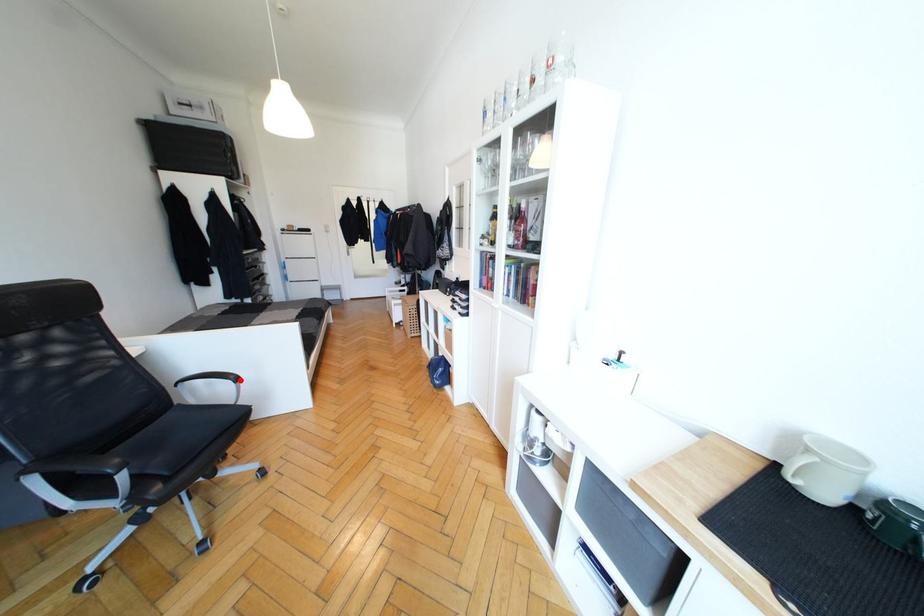
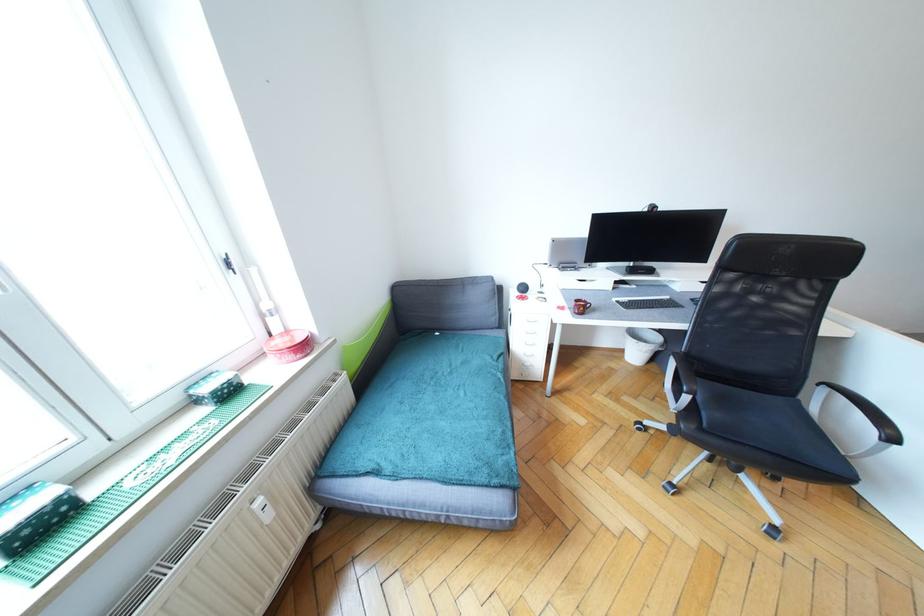
In the second image, find the point that corresponds to the highlighted location in the first image.

(896, 440)